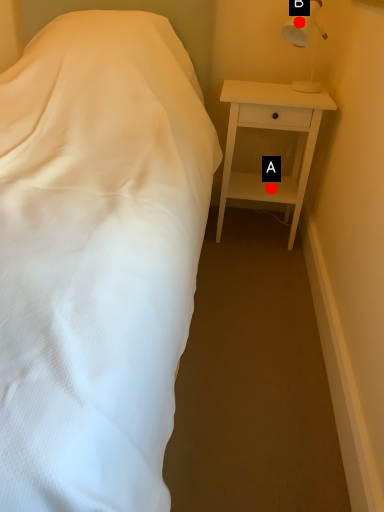
Question: Two points are circled on the image, labeled by A and B beside each circle. Among these points, which one is farthest from the camera?

Choices:
 (A) A is further
 (B) B is further

Answer: (A)